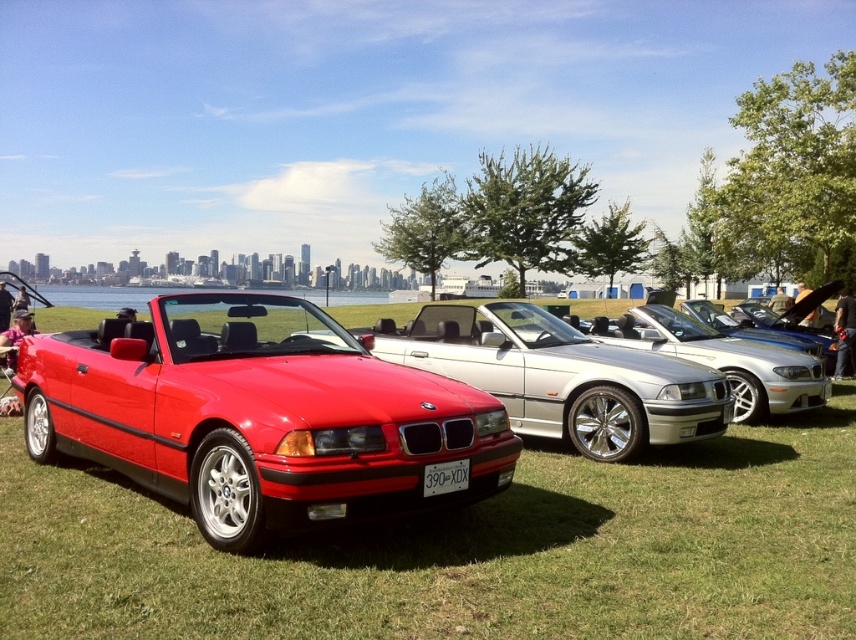
Question: Where is matte red convertible at left located in relation to shiny metallic silver convertible at center in the image?

Choices:
 (A) left
 (B) right

Answer: (A)

Question: Can you confirm if matte red convertible at left is thinner than shiny metallic silver convertible at center?

Choices:
 (A) yes
 (B) no

Answer: (B)

Question: Is matte red convertible at left to the left of shiny metallic silver convertible at center from the viewer's perspective?

Choices:
 (A) yes
 (B) no

Answer: (A)

Question: Which point is closer to the camera?

Choices:
 (A) (467, 445)
 (B) (468, 324)

Answer: (A)

Question: Which point appears farthest from the camera in this image?

Choices:
 (A) (40, 358)
 (B) (456, 324)

Answer: (B)